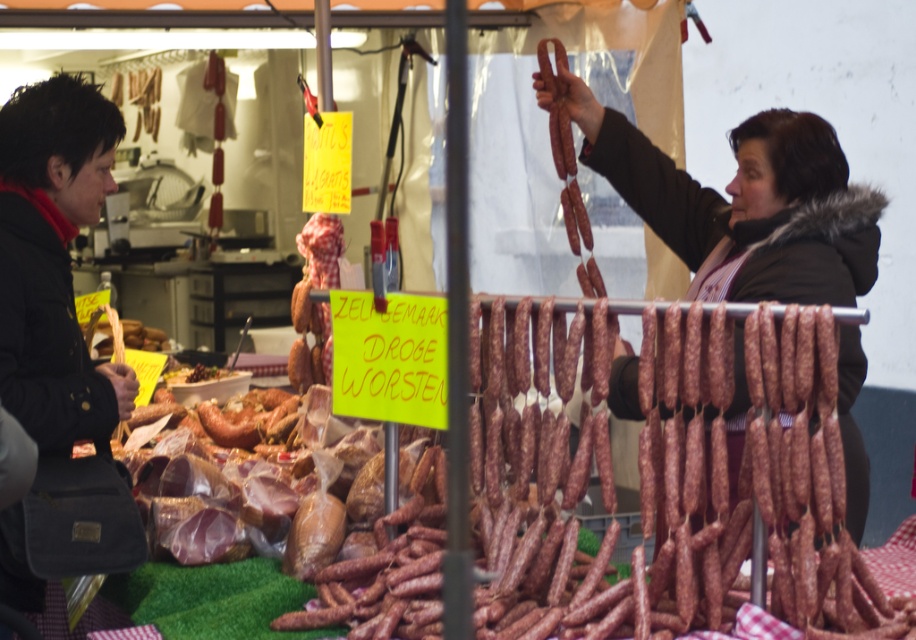
Can you confirm if black fabric bag at left is positioned above shiny brown meat at center?

Yes, black fabric bag at left is above shiny brown meat at center.

Can you confirm if black fabric bag at left is smaller than shiny brown meat at center?

Actually, black fabric bag at left might be larger than shiny brown meat at center.

Between point (53, 90) and point (226, 371), which one is positioned behind?

Positioned behind is point (226, 371).

Find the location of `black fabric bag at left`. black fabric bag at left is located at coordinates (53, 262).